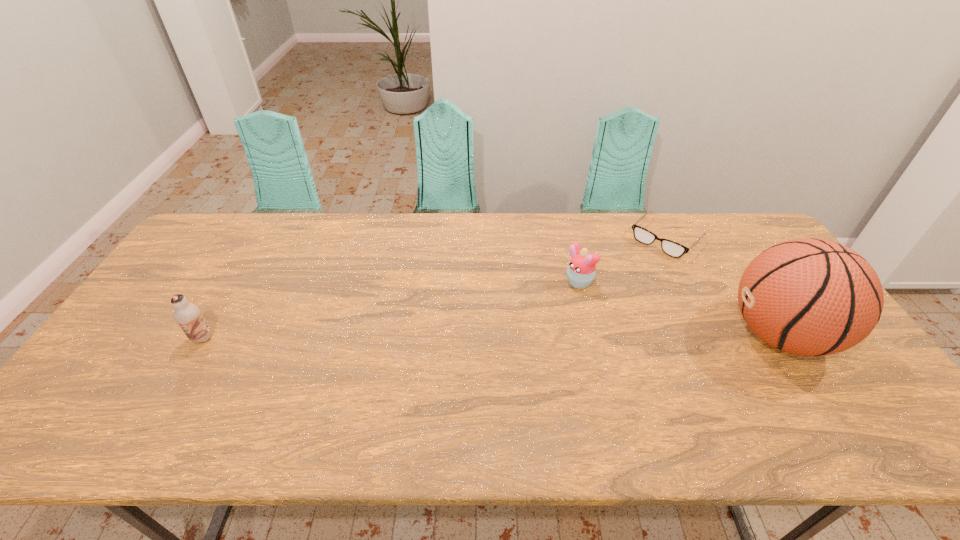
The height and width of the screenshot is (540, 960). I want to click on the leftmost object, so click(x=188, y=316).

Locate an element on the screen. the second tallest object is located at coordinates (188, 316).

The width and height of the screenshot is (960, 540). I want to click on the tallest object, so click(810, 297).

At what (x,y) coordinates should I click in order to perform the action: click on the third object from right to left. Please return your answer as a coordinate pair (x, y). The image size is (960, 540). Looking at the image, I should click on (581, 271).

Locate an element on the screen. the second shortest object is located at coordinates (581, 271).

Where is `the farthest object`? This screenshot has height=540, width=960. the farthest object is located at coordinates (671, 248).

At what (x,y) coordinates should I click in order to perform the action: click on spectacles. Please return your answer as a coordinate pair (x, y). Image resolution: width=960 pixels, height=540 pixels. Looking at the image, I should click on (671, 248).

Where is `vacant space located on the back of the second tallest object`? The image size is (960, 540). vacant space located on the back of the second tallest object is located at coordinates (258, 242).

In order to click on free space located 0.190m on the side where the inflation valve is located in this screenshot , I will do `click(655, 335)`.

The width and height of the screenshot is (960, 540). What are the coordinates of `free point located on the side where the inflation valve is located` in the screenshot? It's located at pos(669,335).